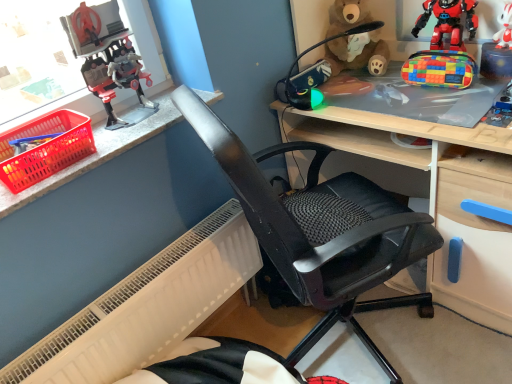
The height and width of the screenshot is (384, 512). Identify the location of empty space that is to the right of translucent plastic basket at left. (115, 144).